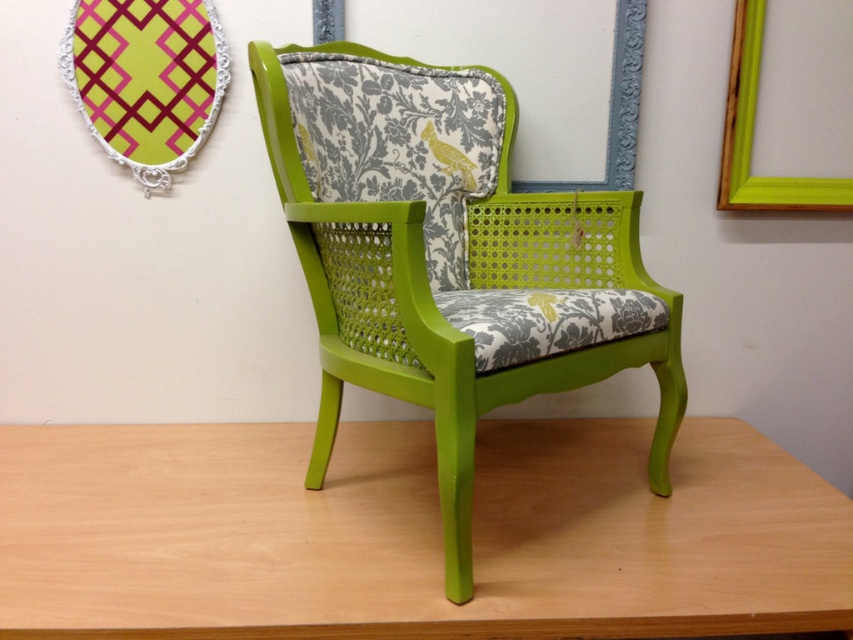
Question: Which object is closer to the camera taking this photo?

Choices:
 (A) wooden table at center
 (B) green matte picture frame at upper right
 (C) matte plastic picture frame at upper left
 (D) lime green cane armchair at center

Answer: (D)

Question: Is wooden table at center to the left of green matte picture frame at upper right from the viewer's perspective?

Choices:
 (A) no
 (B) yes

Answer: (B)

Question: Can you confirm if wooden table at center is positioned to the left of matte plastic picture frame at upper left?

Choices:
 (A) no
 (B) yes

Answer: (A)

Question: Considering the relative positions of lime green cane armchair at center and matte plastic picture frame at upper left in the image provided, where is lime green cane armchair at center located with respect to matte plastic picture frame at upper left?

Choices:
 (A) above
 (B) below

Answer: (B)

Question: Based on their relative distances, which object is farther from the matte plastic picture frame at upper left?

Choices:
 (A) lime green cane armchair at center
 (B) green matte picture frame at upper right

Answer: (B)

Question: Which is nearer to the matte plastic picture frame at upper left?

Choices:
 (A) green matte picture frame at upper right
 (B) wooden table at center

Answer: (B)